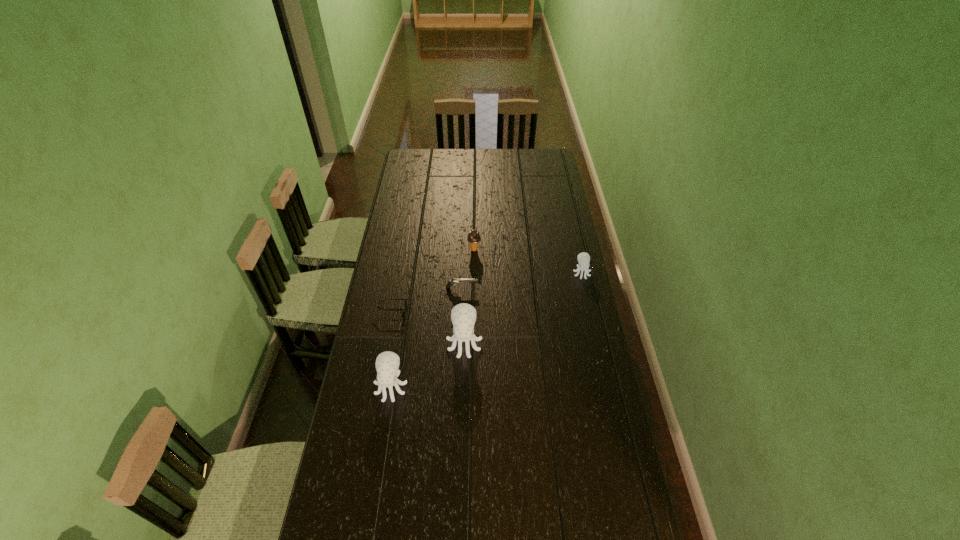
Locate an element on the screen. free location that satisfies the following two spatial constraints: 1. on the front-facing side of the pistol; 2. on the front-facing side of the second shortest octopus is located at coordinates (458, 386).

The image size is (960, 540). Find the location of `free point that satisfies the following two spatial constraints: 1. on the front-facing side of the rightmost object; 2. on the front-facing side of the second shortest object`. free point that satisfies the following two spatial constraints: 1. on the front-facing side of the rightmost object; 2. on the front-facing side of the second shortest object is located at coordinates (585, 288).